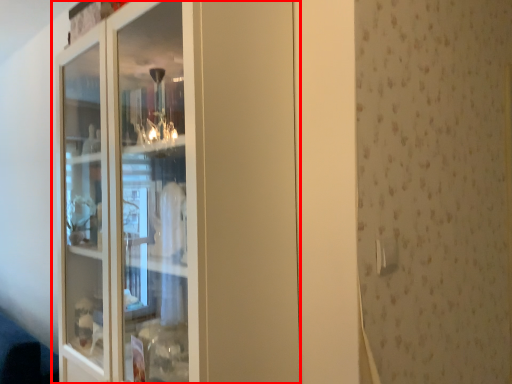
Question: From the image, what is the correct spatial relationship of cupboard (annotated by the red box) in relation to door handle?

Choices:
 (A) right
 (B) left

Answer: (B)